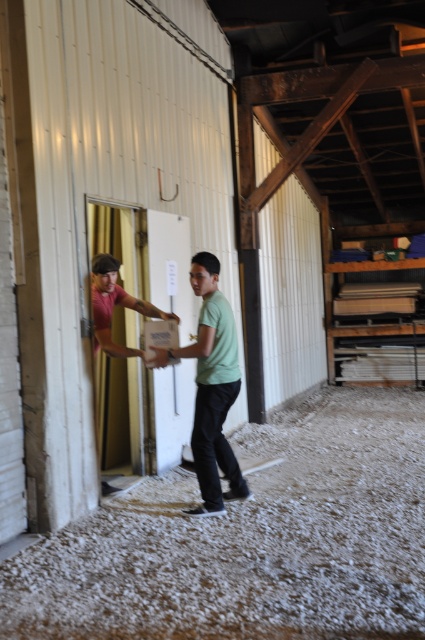
Question: Is white gravel at lower center further to the viewer compared to green matte shirt at center?

Choices:
 (A) yes
 (B) no

Answer: (B)

Question: Which point is closer to the camera taking this photo?

Choices:
 (A) (99, 288)
 (B) (365, 472)

Answer: (A)

Question: Can you confirm if white gravel at lower center is smaller than matte pink shirt at left?

Choices:
 (A) yes
 (B) no

Answer: (A)

Question: Estimate the real-world distances between objects in this image. Which object is farther from the white gravel at lower center?

Choices:
 (A) green matte shirt at center
 (B) matte pink shirt at left

Answer: (B)

Question: Estimate the real-world distances between objects in this image. Which object is closer to the matte pink shirt at left?

Choices:
 (A) white gravel at lower center
 (B) green matte shirt at center

Answer: (B)

Question: Where is green matte shirt at center located in relation to matte pink shirt at left in the image?

Choices:
 (A) right
 (B) left

Answer: (A)